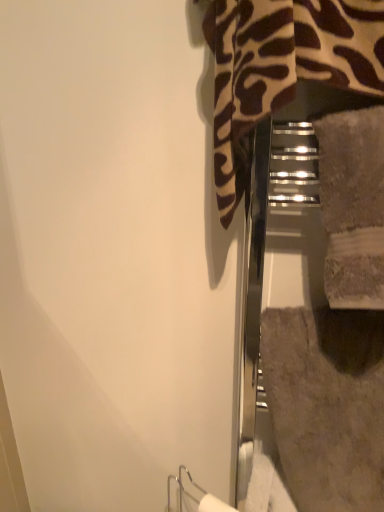
Where is `beige textured towel at center`? beige textured towel at center is located at coordinates (353, 206).

The height and width of the screenshot is (512, 384). What do you see at coordinates (353, 206) in the screenshot?
I see `beige textured towel at center` at bounding box center [353, 206].

What do you see at coordinates (327, 404) in the screenshot? The width and height of the screenshot is (384, 512). I see `gray textured bath towel at right` at bounding box center [327, 404].

You are a GUI agent. You are given a task and a screenshot of the screen. Output one action in this format:
    pyautogui.click(x=<x>, y=<y>)
    Task: Click on the gray textured bath towel at right
    This screenshot has height=512, width=384.
    Given the screenshot: What is the action you would take?
    pyautogui.click(x=327, y=404)

Where is `beige textured towel at center`? beige textured towel at center is located at coordinates (353, 206).

Considering the relative positions of gray textured bath towel at right and beige textured towel at center in the image provided, is gray textured bath towel at right to the left of beige textured towel at center from the viewer's perspective?

In fact, gray textured bath towel at right is to the right of beige textured towel at center.

Considering their positions, is gray textured bath towel at right located in front of or behind beige textured towel at center?

In the image, gray textured bath towel at right appears behind beige textured towel at center.

Is point (340, 442) positioned behind point (370, 251)?

Yes.

From the image's perspective, relative to beige textured towel at center, is gray textured bath towel at right above or below?

From the image's perspective, gray textured bath towel at right appears below beige textured towel at center.

From a real-world perspective, between gray textured bath towel at right and beige textured towel at center, who is vertically higher?

beige textured towel at center is physically above.

In the scene shown: Considering the sizes of objects gray textured bath towel at right and beige textured towel at center in the image provided, who is thinner, gray textured bath towel at right or beige textured towel at center?

beige textured towel at center.

Does gray textured bath towel at right have a lesser height compared to beige textured towel at center?

No.

Does gray textured bath towel at right have a smaller size compared to beige textured towel at center?

Actually, gray textured bath towel at right might be larger than beige textured towel at center.

Could beige textured towel at center be considered to be inside gray textured bath towel at right?

No, beige textured towel at center is not surrounded by gray textured bath towel at right.

Is gray textured bath towel at right positioned far away from beige textured towel at center?

gray textured bath towel at right is near beige textured towel at center, not far away.

Based on the photo, does gray textured bath towel at right turn towards beige textured towel at center?

No.

Find the location of `bath towel located below the beige textured towel at center (from the image's perspective)`. bath towel located below the beige textured towel at center (from the image's perspective) is located at coordinates (327, 404).

Which is more to the right, beige textured towel at center or gray textured bath towel at right?

From the viewer's perspective, gray textured bath towel at right appears more on the right side.

Considering the relative positions of beige textured towel at center and gray textured bath towel at right in the image provided, is beige textured towel at center in front of gray textured bath towel at right?

That is True.

Considering the points (352, 262) and (319, 415), which point is in front, point (352, 262) or point (319, 415)?

The point (352, 262) is closer.

Consider the image. From the image's perspective, relative to gray textured bath towel at right, is beige textured towel at center above or below?

Clearly, from the image's perspective, beige textured towel at center is above gray textured bath towel at right.

From a real-world perspective, between beige textured towel at center and gray textured bath towel at right, who is vertically lower?

gray textured bath towel at right, from a real-world perspective.

Considering the relative sizes of beige textured towel at center and gray textured bath towel at right in the image provided, is beige textured towel at center thinner than gray textured bath towel at right?

Yes, beige textured towel at center is thinner than gray textured bath towel at right.

Between beige textured towel at center and gray textured bath towel at right, which one has more height?

gray textured bath towel at right is taller.

Considering the sizes of objects beige textured towel at center and gray textured bath towel at right in the image provided, who is bigger, beige textured towel at center or gray textured bath towel at right?

gray textured bath towel at right.

Is beige textured towel at center spatially inside gray textured bath towel at right, or outside of it?

beige textured towel at center exists outside the volume of gray textured bath towel at right.

Is beige textured towel at center far away from gray textured bath towel at right?

No, there isn't a large distance between beige textured towel at center and gray textured bath towel at right.

Could you tell me if beige textured towel at center is turned towards gray textured bath towel at right?

No, beige textured towel at center is not turned towards gray textured bath towel at right.

Locate an element on the screen. The height and width of the screenshot is (512, 384). bath towel below the beige textured towel at center (from a real-world perspective) is located at coordinates (327, 404).

I want to click on bath towel that appears below the beige textured towel at center (from the image's perspective), so click(327, 404).

Identify the location of bath towel behind the beige textured towel at center. (327, 404).